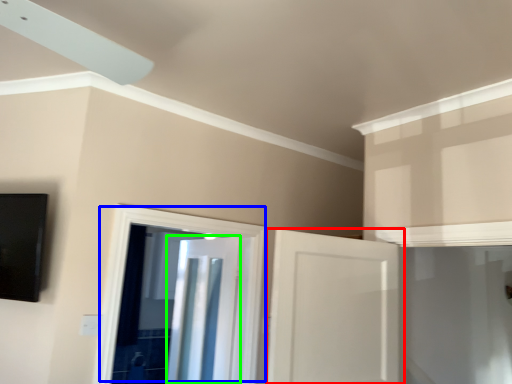
Question: Which is farther away from door (highlighted by a red box)? door (highlighted by a blue box) or door (highlighted by a green box)?

Choices:
 (A) door
 (B) door

Answer: (B)